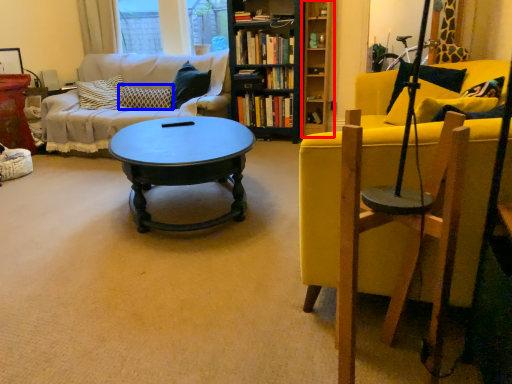
Question: Among these objects, which one is nearest to the camera, shelf (highlighted by a red box) or pillow (highlighted by a blue box)?

Choices:
 (A) shelf
 (B) pillow

Answer: (A)